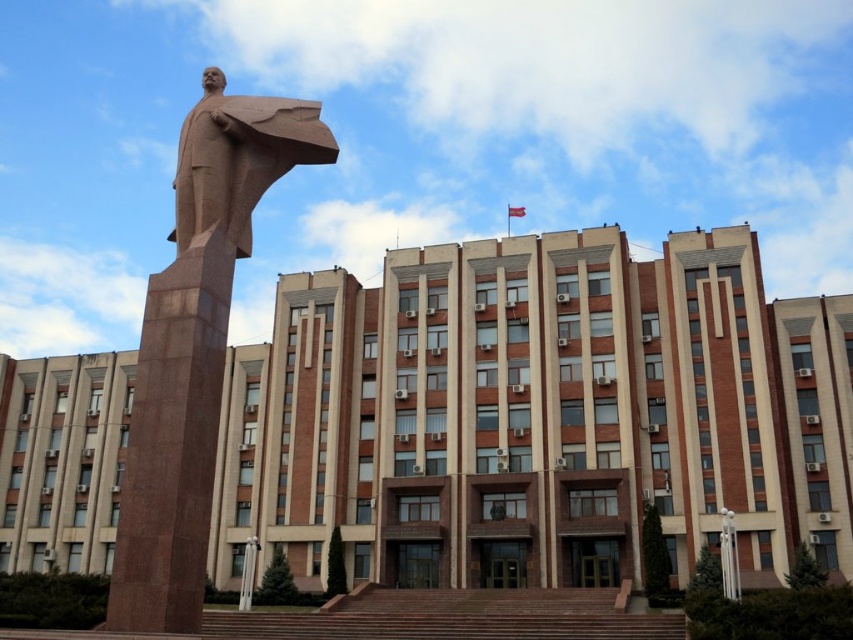
Question: Can you confirm if brown polished stone statue at left is smaller than brown stone statue at left?

Choices:
 (A) yes
 (B) no

Answer: (B)

Question: Is brown polished stone statue at left below brown stone statue at left?

Choices:
 (A) no
 (B) yes

Answer: (B)

Question: Which object appears closest to the camera in this image?

Choices:
 (A) brown polished stone statue at left
 (B) brown stone statue at left

Answer: (A)

Question: Can you confirm if brown polished stone statue at left is bigger than brown stone statue at left?

Choices:
 (A) no
 (B) yes

Answer: (B)